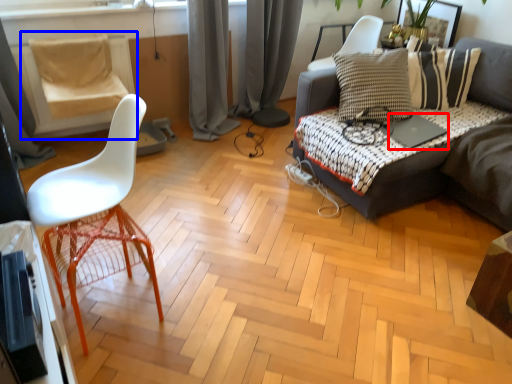
Question: Which object is further to the camera taking this photo, laptop (highlighted by a red box) or swivel chair (highlighted by a blue box)?

Choices:
 (A) laptop
 (B) swivel chair

Answer: (B)